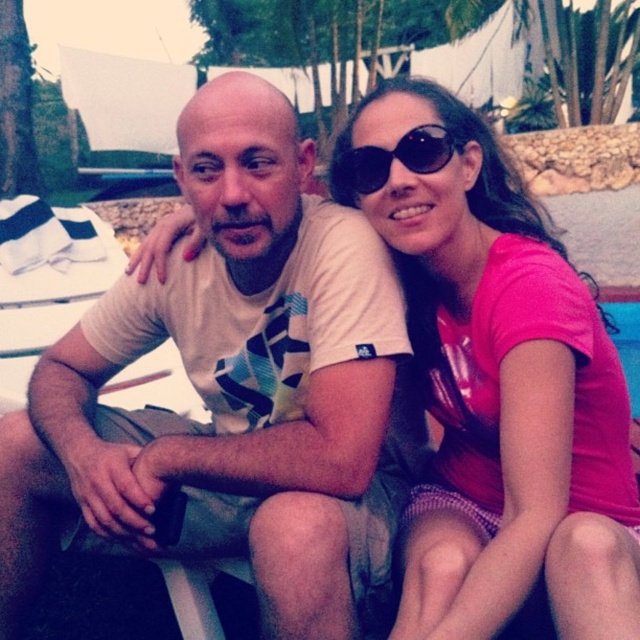
Does pink matte shirt at center come behind black plastic sunglasses at upper center?

No, pink matte shirt at center is closer to the viewer.

Which is above, pink matte shirt at center or black plastic sunglasses at upper center?

black plastic sunglasses at upper center

Between point (506, 301) and point (364, 163), which one is positioned in front?

Point (506, 301)

What are the coordinates of `pink matte shirt at center` in the screenshot? It's located at (497, 381).

Between white cotton t-shirt at center and black plastic sunglasses at upper center, which one has more height?

Standing taller between the two is white cotton t-shirt at center.

Who is positioned more to the right, white cotton t-shirt at center or black plastic sunglasses at upper center?

black plastic sunglasses at upper center is more to the right.

At what (x,y) coordinates should I click in order to perform the action: click on white cotton t-shirt at center. Please return your answer as a coordinate pair (x, y). Looking at the image, I should click on (232, 387).

Find the location of a particular element. The width and height of the screenshot is (640, 640). white cotton t-shirt at center is located at coordinates (232, 387).

Is point (330, 364) behind point (522, 241)?

No, it is not.

Does point (292, 589) lie in front of point (472, 173)?

Yes, it is in front of point (472, 173).

Between point (3, 609) and point (540, 348), which one is positioned behind?

Point (3, 609)

This screenshot has width=640, height=640. I want to click on white cotton t-shirt at center, so click(x=232, y=387).